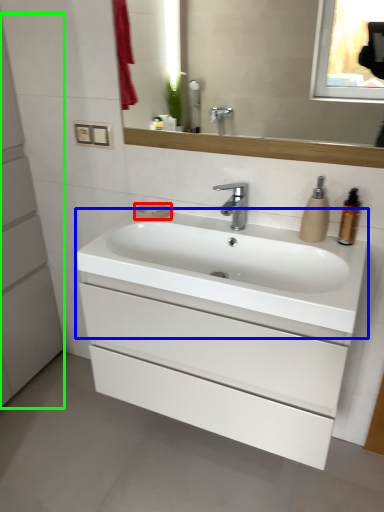
Question: Which is nearer to the soap (highlighted by a red box)? counter top (highlighted by a blue box) or screen door (highlighted by a green box).

Choices:
 (A) counter top
 (B) screen door

Answer: (A)